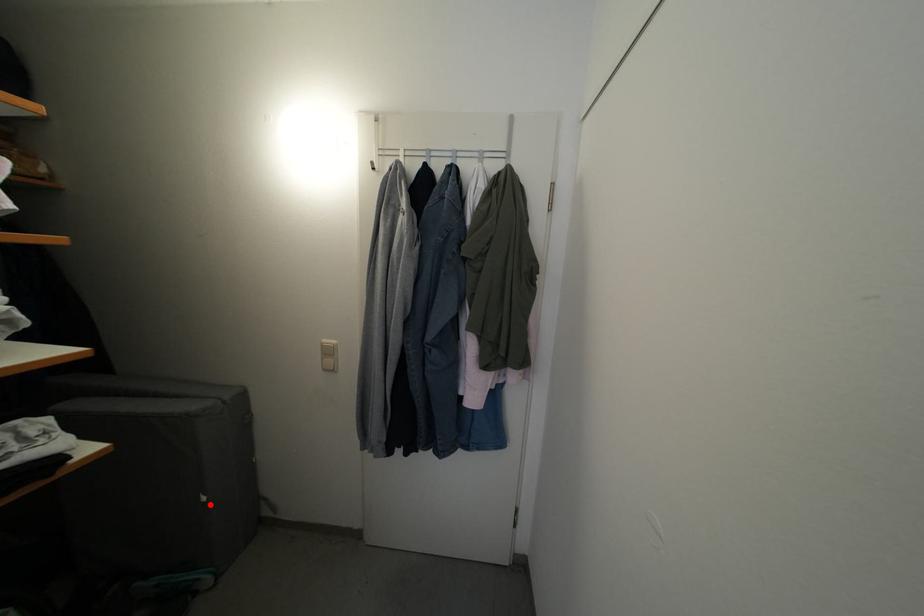
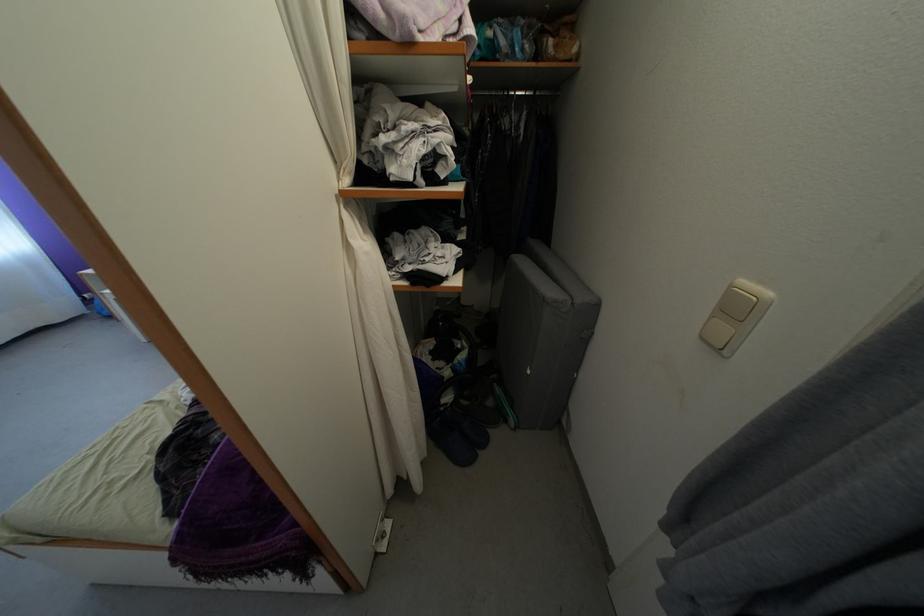
The point at the highlighted location is marked in the first image. Where is the corresponding point in the second image?

(535, 378)